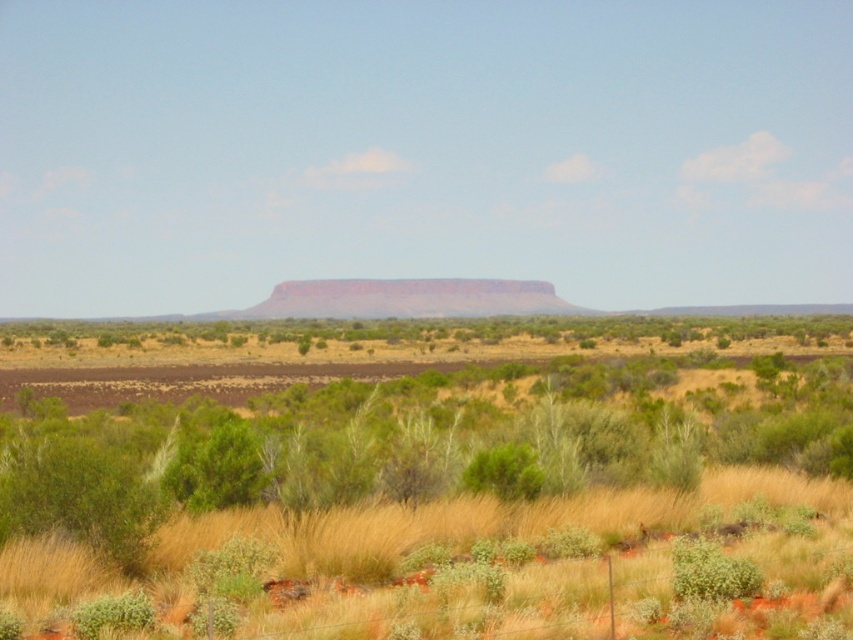
Question: Is grassy plain at center to the right of green leafy bush at center from the viewer's perspective?

Choices:
 (A) no
 (B) yes

Answer: (A)

Question: Which point appears farthest from the camera in this image?

Choices:
 (A) (732, 596)
 (B) (514, 484)
 (C) (463, 632)

Answer: (B)

Question: Is green fuzzy bush at lower right positioned behind green leafy bush at center?

Choices:
 (A) no
 (B) yes

Answer: (A)

Question: Which object is farther from the camera taking this photo?

Choices:
 (A) green fuzzy bush at lower right
 (B) green leafy bush at center

Answer: (B)

Question: Which point is farther to the camera?

Choices:
 (A) green fuzzy bush at lower right
 (B) green leafy bush at center

Answer: (B)

Question: Is green fuzzy bush at lower right to the left of green leafy bush at center from the viewer's perspective?

Choices:
 (A) yes
 (B) no

Answer: (B)